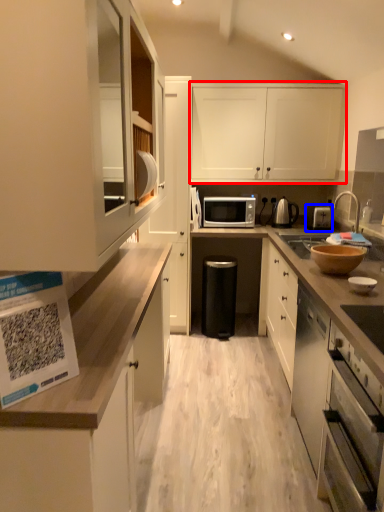
Question: Which object is closer to the camera taking this photo, cabinetry (highlighted by a red box) or toaster (highlighted by a blue box)?

Choices:
 (A) cabinetry
 (B) toaster

Answer: (B)